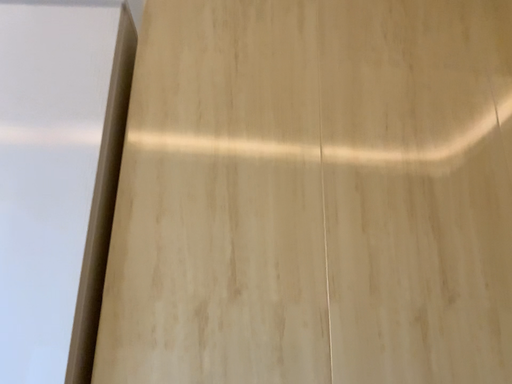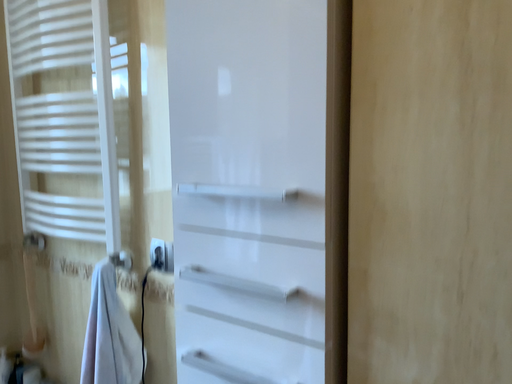
Question: Which way did the camera rotate in the video?

Choices:
 (A) rotated left
 (B) rotated right

Answer: (A)